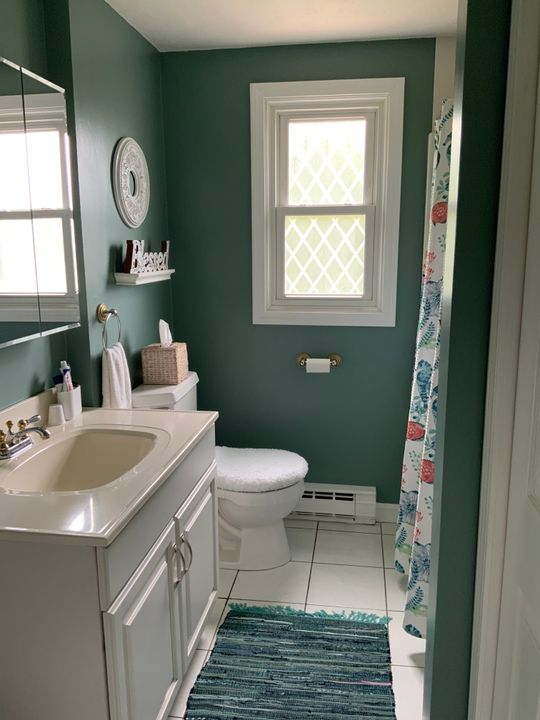
At what (x,y) coordinates should I click in order to perform the action: click on 1 rug. Please return your answer as a coordinate pair (x, y). Looking at the image, I should click on (342, 692).